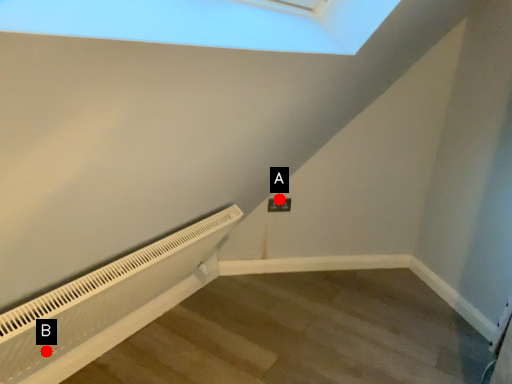
Question: Two points are circled on the image, labeled by A and B beside each circle. Which point appears farthest from the camera in this image?

Choices:
 (A) A is further
 (B) B is further

Answer: (A)